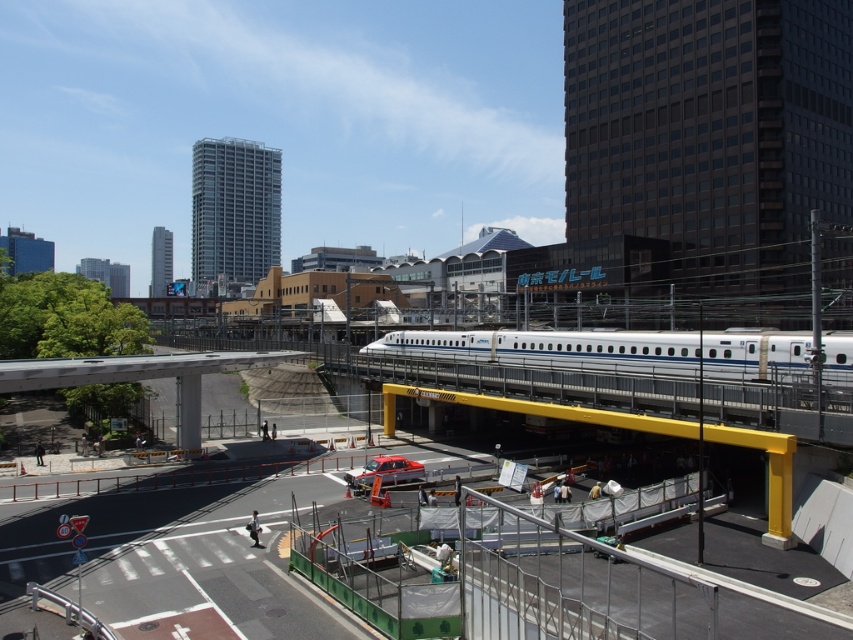
Question: Is the position of white glossy passenger train at center more distant than that of metallic silver car at center?

Choices:
 (A) no
 (B) yes

Answer: (A)

Question: Does white glossy passenger train at center appear on the right side of metallic silver car at center?

Choices:
 (A) no
 (B) yes

Answer: (B)

Question: Which point is closer to the camera?

Choices:
 (A) white glossy passenger train at center
 (B) metallic silver car at center

Answer: (A)

Question: Does white glossy passenger train at center have a lesser width compared to metallic silver car at center?

Choices:
 (A) no
 (B) yes

Answer: (A)